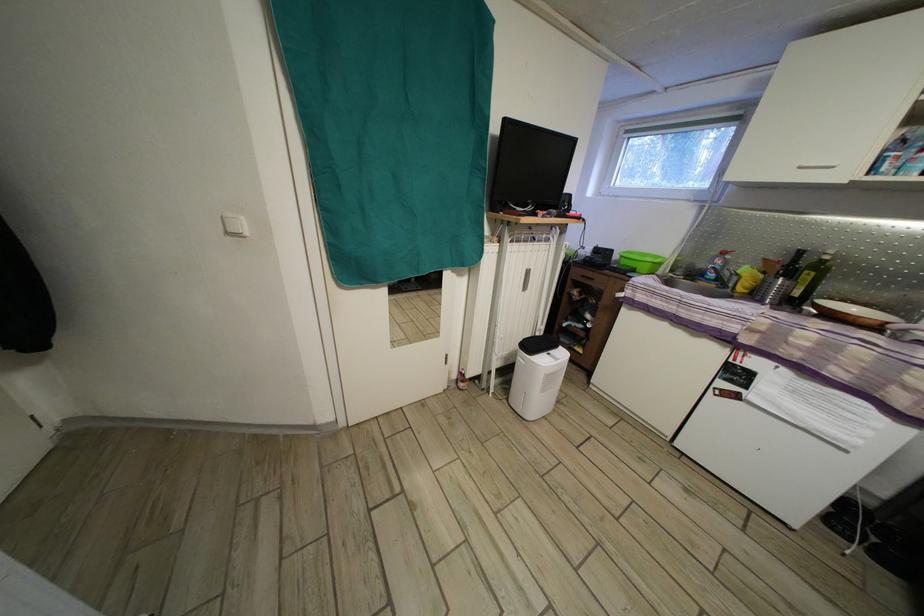
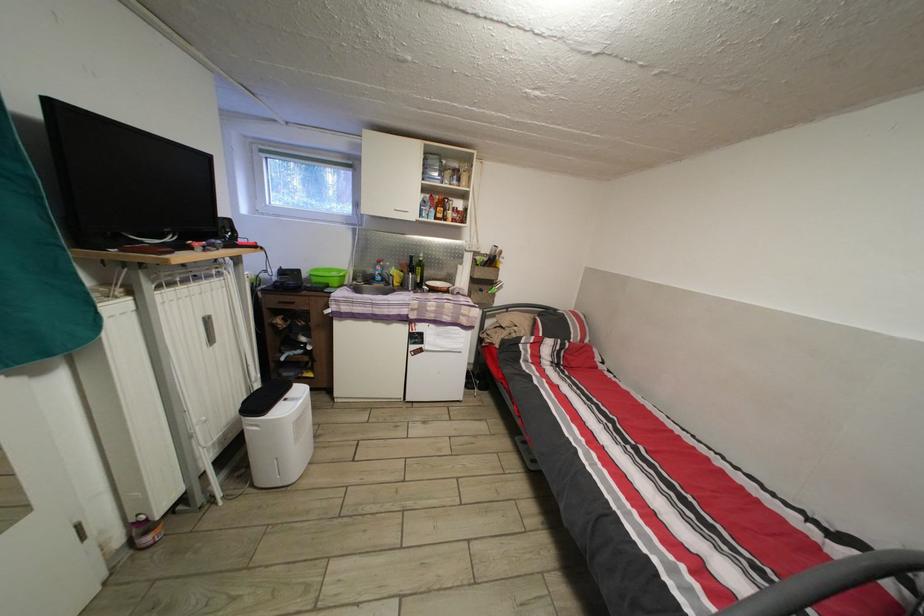
Where in the second image is the point corresponding to [622,262] from the first image?

(311, 282)